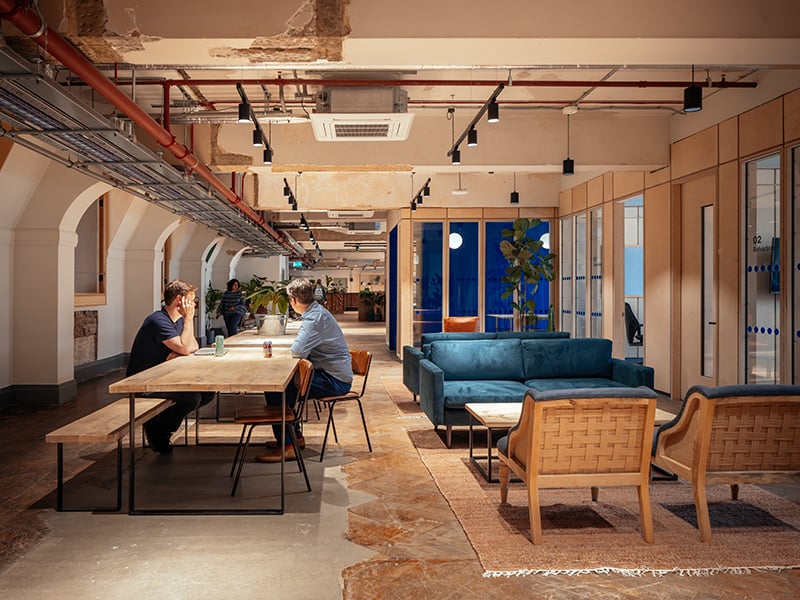
Locate an element on the screen. This screenshot has width=800, height=600. sofas is located at coordinates (492, 380), (466, 333).